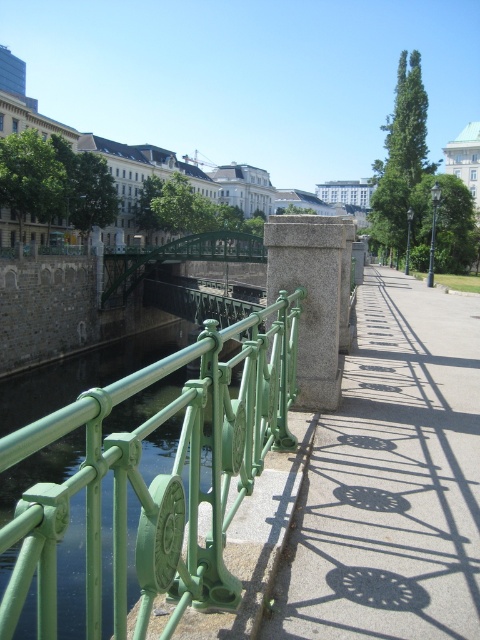
You are a delivery person with a cart that is 2 meters wide. You need to transport items from one side of the river to the other. The smooth concrete sidewalk at center and the green metal pedestrian bridge at center are both potential paths. Which path can your cart fit through?

The green metal pedestrian bridge at center has a greater width than the smooth concrete sidewalk at center. Since your cart is 2 meters wide, the green metal pedestrian bridge at center is wide enough to accommodate it, while the sidewalk may be too narrow.

You are a photographer standing at the riverside pathway. You want to take a photo that includes both the green metal fence at center and the green metal pedestrian bridge at center. Which object should you position closer to the front of your photo frame to ensure both are in focus?

To ensure both the green metal fence at center and the green metal pedestrian bridge at center are in focus, position the green metal fence at center closer to the front of your photo frame since it is nearer to you than the bridge.